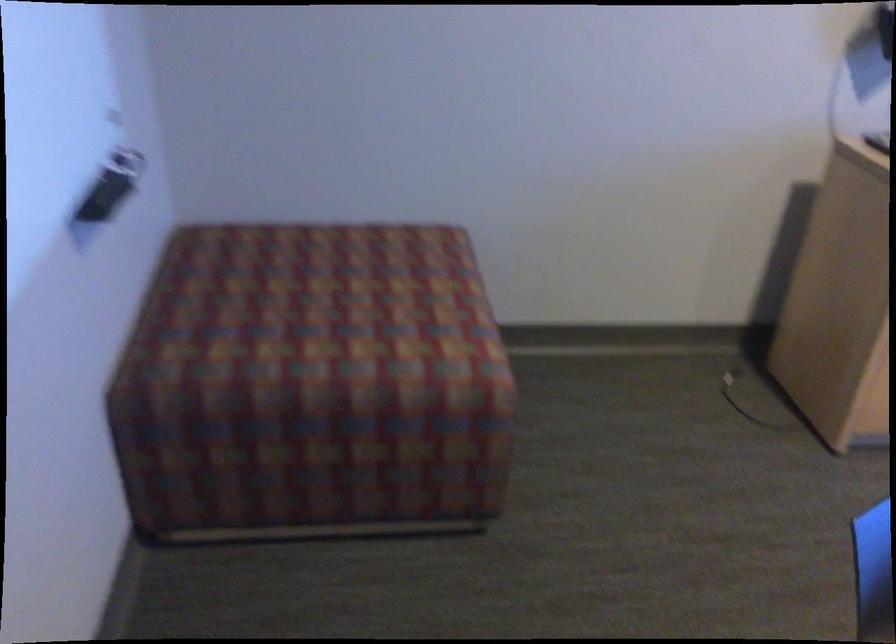
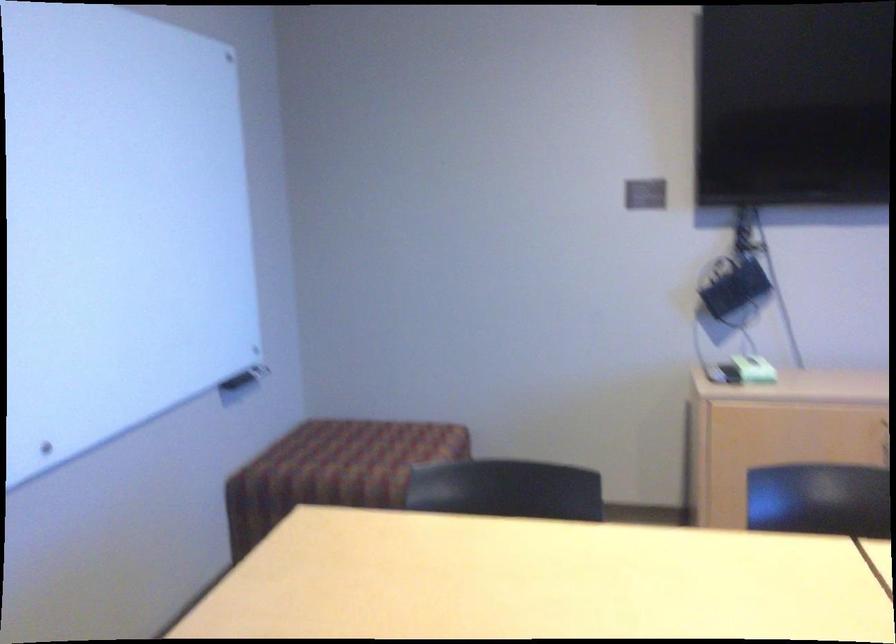
The point at [314,337] is marked in the first image. Where is the corresponding point in the second image?

(331, 465)